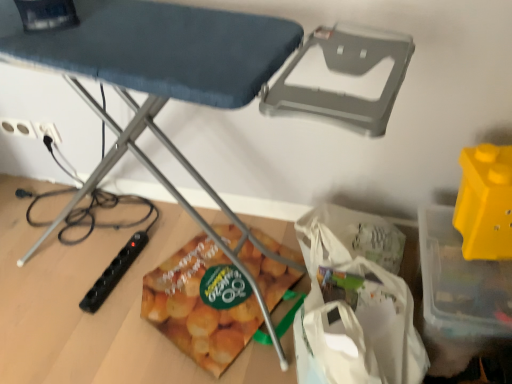
Where is `vacant area to the left of matte plastic snack bag at lower center`? This screenshot has width=512, height=384. vacant area to the left of matte plastic snack bag at lower center is located at coordinates (90, 291).